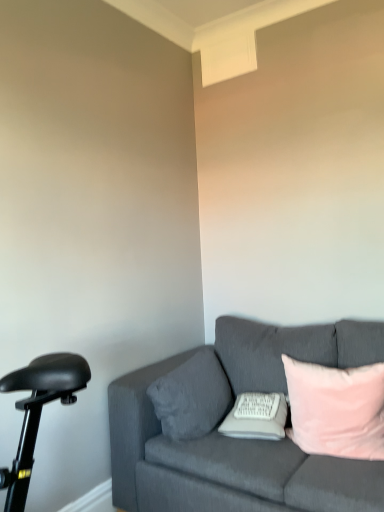
Question: Can you confirm if pink velvet pillow at right, which ranks as the third pillow in left-to-right order, is taller than white soft pillow at center, the 2th pillow viewed from the right?

Choices:
 (A) yes
 (B) no

Answer: (A)

Question: Could you tell me if pink velvet pillow at right, the 1th pillow when ordered from right to left, is facing white soft pillow at center, which ranks as the 2th pillow in left-to-right order?

Choices:
 (A) yes
 (B) no

Answer: (B)

Question: From the image's perspective, is pink velvet pillow at right, the 1th pillow when ordered from right to left, on top of white soft pillow at center, which ranks as the 2th pillow in left-to-right order?

Choices:
 (A) no
 (B) yes

Answer: (B)

Question: From the image's perspective, is pink velvet pillow at right, the 1th pillow when ordered from right to left, beneath white soft pillow at center, the 2th pillow viewed from the right?

Choices:
 (A) no
 (B) yes

Answer: (A)

Question: From a real-world perspective, is pink velvet pillow at right, the 1th pillow when ordered from right to left, under white soft pillow at center, which ranks as the 2th pillow in left-to-right order?

Choices:
 (A) no
 (B) yes

Answer: (A)

Question: Would you consider pink velvet pillow at right, the 1th pillow when ordered from right to left, to be distant from white soft pillow at center, which ranks as the 2th pillow in left-to-right order?

Choices:
 (A) no
 (B) yes

Answer: (A)

Question: Is pink velvet pillow at right, the 1th pillow when ordered from right to left, at the back of velvet gray pillow at center, positioned as the 1th pillow in left-to-right order?

Choices:
 (A) no
 (B) yes

Answer: (A)

Question: Considering the relative sizes of velvet gray pillow at center, the third pillow positioned from the right, and pink velvet pillow at right, which ranks as the third pillow in left-to-right order, in the image provided, is velvet gray pillow at center, the third pillow positioned from the right, bigger than pink velvet pillow at right, which ranks as the third pillow in left-to-right order,?

Choices:
 (A) yes
 (B) no

Answer: (B)

Question: Is the surface of velvet gray pillow at center, positioned as the 1th pillow in left-to-right order, in direct contact with pink velvet pillow at right, the 1th pillow when ordered from right to left?

Choices:
 (A) no
 (B) yes

Answer: (A)

Question: Is velvet gray pillow at center, the third pillow positioned from the right, oriented towards pink velvet pillow at right, which ranks as the third pillow in left-to-right order?

Choices:
 (A) no
 (B) yes

Answer: (B)

Question: Can you confirm if velvet gray pillow at center, positioned as the 1th pillow in left-to-right order, is taller than pink velvet pillow at right, which ranks as the third pillow in left-to-right order?

Choices:
 (A) yes
 (B) no

Answer: (B)

Question: Considering the relative sizes of velvet gray pillow at center, positioned as the 1th pillow in left-to-right order, and pink velvet pillow at right, the 1th pillow when ordered from right to left, in the image provided, is velvet gray pillow at center, positioned as the 1th pillow in left-to-right order, wider than pink velvet pillow at right, the 1th pillow when ordered from right to left,?

Choices:
 (A) no
 (B) yes

Answer: (A)

Question: Is white soft pillow at center, which ranks as the 2th pillow in left-to-right order, looking in the opposite direction of velvet gray pillow at center, positioned as the 1th pillow in left-to-right order?

Choices:
 (A) yes
 (B) no

Answer: (B)